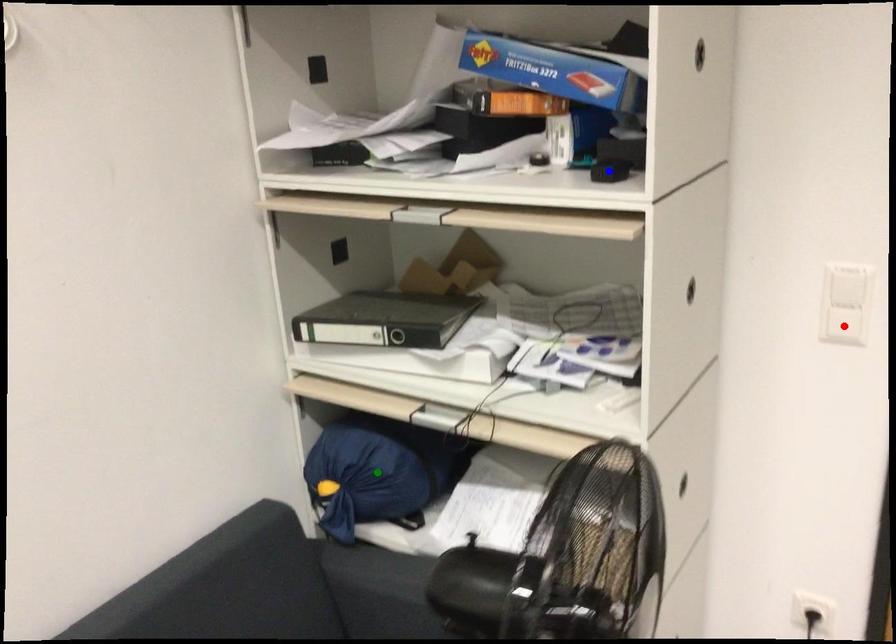
Order these from nearest to farthest:
blue point, red point, green point

green point, red point, blue point